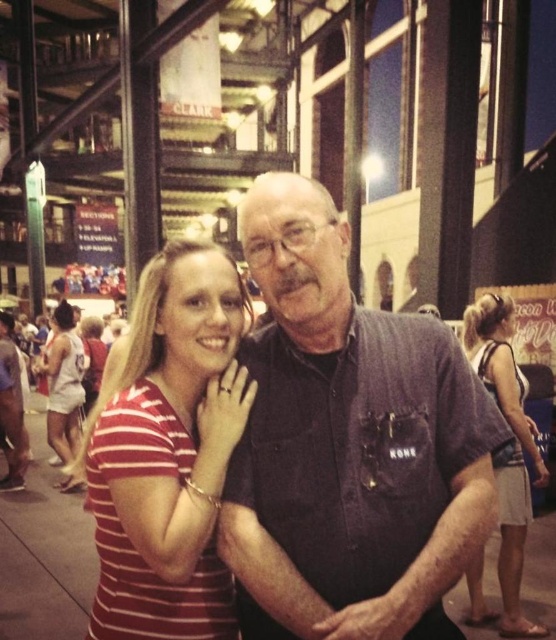
How much distance is there between dark blue shirt at center and striped cotton shirt at center?

43.87 centimeters

Between dark blue shirt at center and striped cotton shirt at center, which one appears on the left side from the viewer's perspective?

From the viewer's perspective, striped cotton shirt at center appears more on the left side.

Based on the photo, who is more forward, (x=374, y=608) or (x=215, y=445)?

Positioned in front is point (x=374, y=608).

I want to click on dark blue shirt at center, so click(348, 444).

Does dark blue shirt at center have a greater width compared to light brown textured shorts at lower right?

Correct, the width of dark blue shirt at center exceeds that of light brown textured shorts at lower right.

Measure the distance between dark blue shirt at center and light brown textured shorts at lower right.

A distance of 2.93 meters exists between dark blue shirt at center and light brown textured shorts at lower right.

The image size is (556, 640). Find the location of `dark blue shirt at center`. dark blue shirt at center is located at coordinates (348, 444).

The image size is (556, 640). I want to click on dark blue shirt at center, so click(348, 444).

Who is positioned more to the left, dark blue shirt at center or white jersey at left?

white jersey at left

Image resolution: width=556 pixels, height=640 pixels. In order to click on dark blue shirt at center in this screenshot , I will do `click(348, 444)`.